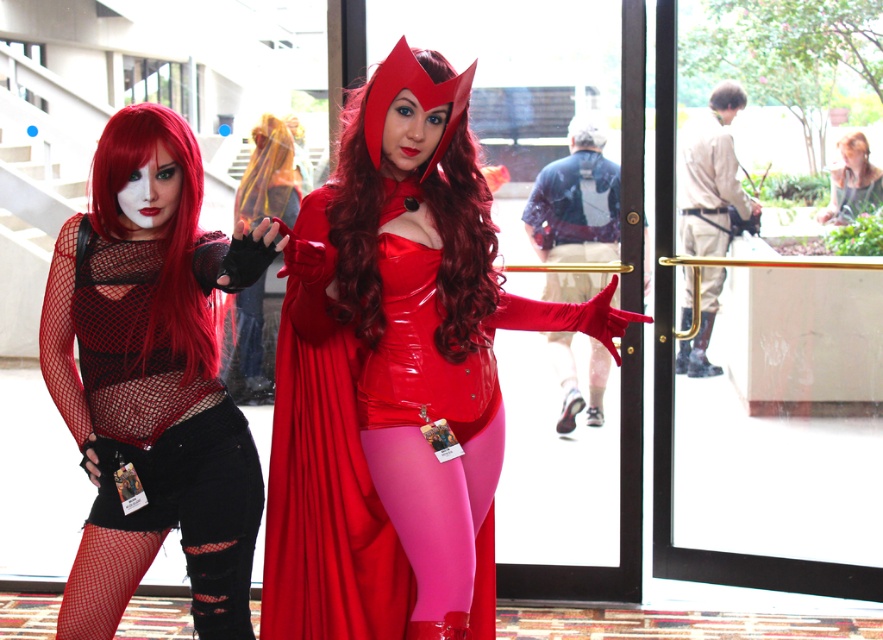
Can you confirm if fishnet fabric top at left is taller than matte black wig at upper center?

Indeed, fishnet fabric top at left has a greater height compared to matte black wig at upper center.

Between fishnet fabric top at left and matte black wig at upper center, which one has less height?

matte black wig at upper center is shorter.

What do you see at coordinates (153, 378) in the screenshot? I see `fishnet fabric top at left` at bounding box center [153, 378].

At what (x,y) coordinates should I click in order to perform the action: click on fishnet fabric top at left. Please return your answer as a coordinate pair (x, y). Image resolution: width=883 pixels, height=640 pixels. Looking at the image, I should click on [153, 378].

Is fishnet fabric top at left shorter than shiny red wig at center?

In fact, fishnet fabric top at left may be taller than shiny red wig at center.

Does fishnet fabric top at left have a smaller size compared to shiny red wig at center?

Actually, fishnet fabric top at left might be larger than shiny red wig at center.

Measure the distance between point (229, 260) and camera.

Point (229, 260) is 7.94 feet from camera.

Find the location of a particular element. The width and height of the screenshot is (883, 640). fishnet fabric top at left is located at coordinates (153, 378).

Does shiny red costume at center appear on the left side of red mesh wig at left?

In fact, shiny red costume at center is to the right of red mesh wig at left.

Which is in front, point (268, 620) or point (192, 300)?

Point (192, 300) is more forward.

The width and height of the screenshot is (883, 640). I want to click on shiny red costume at center, so click(x=395, y=376).